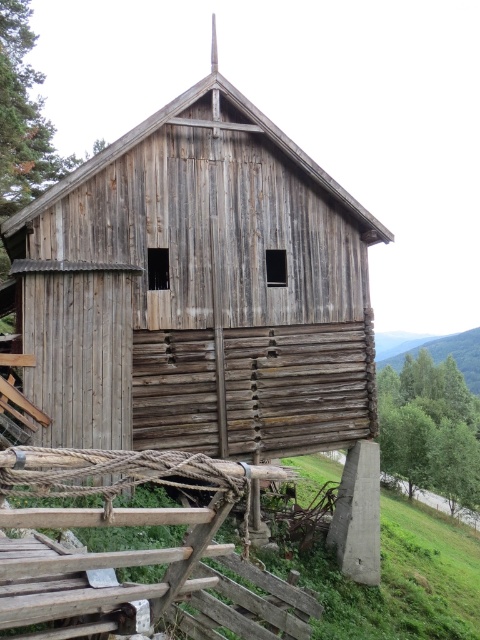
You are a painter planning to sketch the weathered wood barn at center and the green leafy hillside at upper right. Which object should you focus on first if you want to capture the larger subject in your painting?

The weathered wood barn at center should be focused on first because it has a larger size compared to the green leafy hillside at upper right.

You are standing at the entrance of the old wooden structure and want to locate the rustic wooden fence at lower left. According to the coordinates provided, where exactly should you look to find it?

The rustic wooden fence at lower left is located at point [136,557].

You are standing in front of the old wooden structure and notice the rustic wooden fence at lower left and the green leafy hillside at upper right. Which of these two objects takes up more visual space in the scene?

The green leafy hillside at upper right occupies more visual space than the rustic wooden fence at lower left.